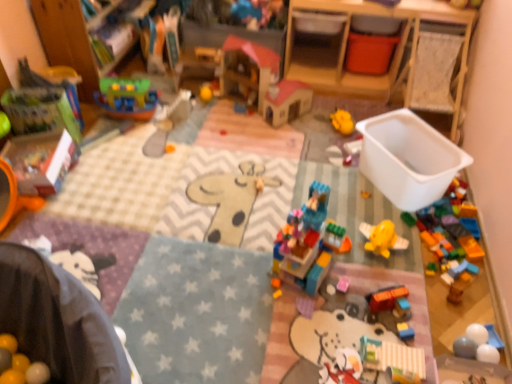
Identify the location of free point to the left of wooden dollhouse at center, marked as the 2th toy in a top-to-bottom arrangement. (200, 114).